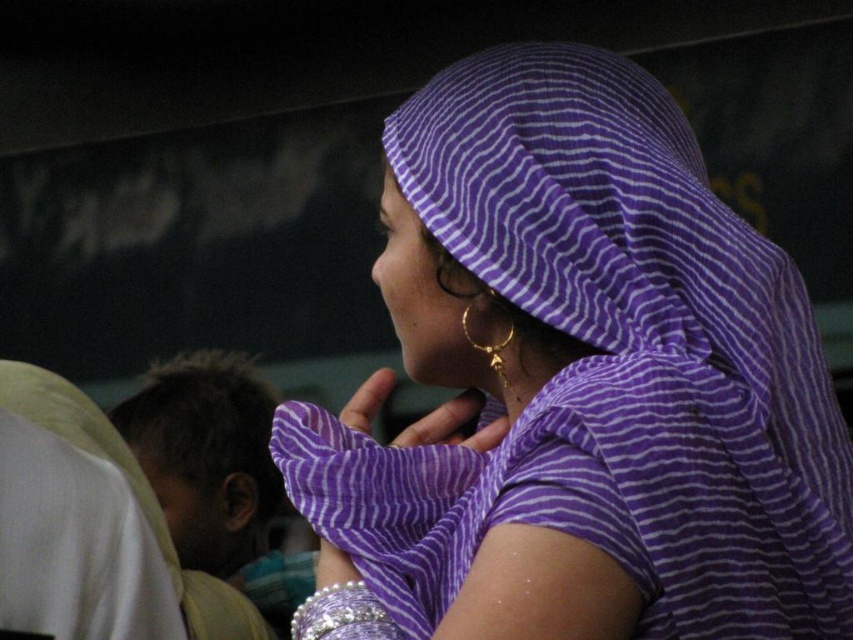
Question: Does purple striped scarf at upper right appear on the left side of goldeffectearring at center?

Choices:
 (A) yes
 (B) no

Answer: (B)

Question: Which point appears farthest from the camera in this image?

Choices:
 (A) (207, 461)
 (B) (537, 260)

Answer: (A)

Question: Which point appears farthest from the camera in this image?

Choices:
 (A) (486, 444)
 (B) (351, 637)

Answer: (A)

Question: Considering the real-world distances, which object is closest to the goldeffectearring at center?

Choices:
 (A) brown hair at left
 (B) purple striped scarf at upper right

Answer: (B)

Question: Is goldeffectearring at center bigger than silver metallic bracelet at lower center?

Choices:
 (A) no
 (B) yes

Answer: (B)

Question: Is goldeffectearring at center below silver metallic bracelet at lower center?

Choices:
 (A) yes
 (B) no

Answer: (B)